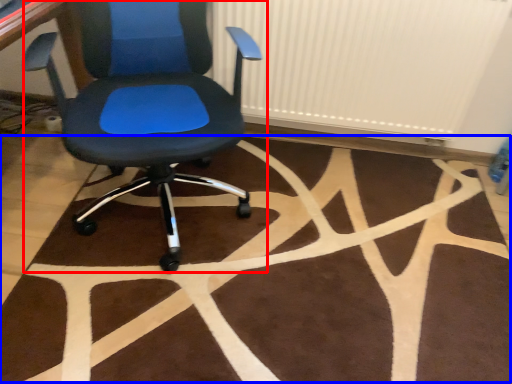
Question: Which point is closer to the camera, chair (highlighted by a red box) or mat (highlighted by a blue box)?

Choices:
 (A) chair
 (B) mat

Answer: (A)